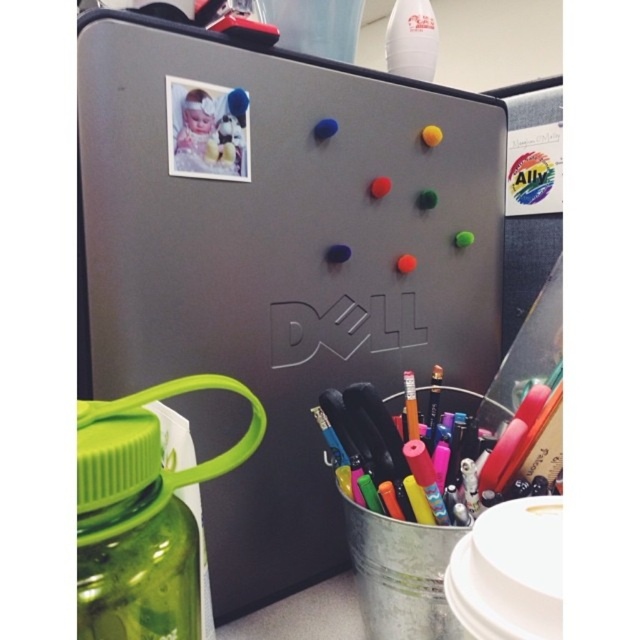
You are organizing the workspace shown in the image. The Dell laptop with colorful magnets on its lid is at the center. Where is the green plastic water bottle at lower left positioned relative to the laptop?

The green plastic water bottle at lower left is located at point (x=148, y=579) relative to the laptop, which means it is positioned to the lower left side of the laptop.